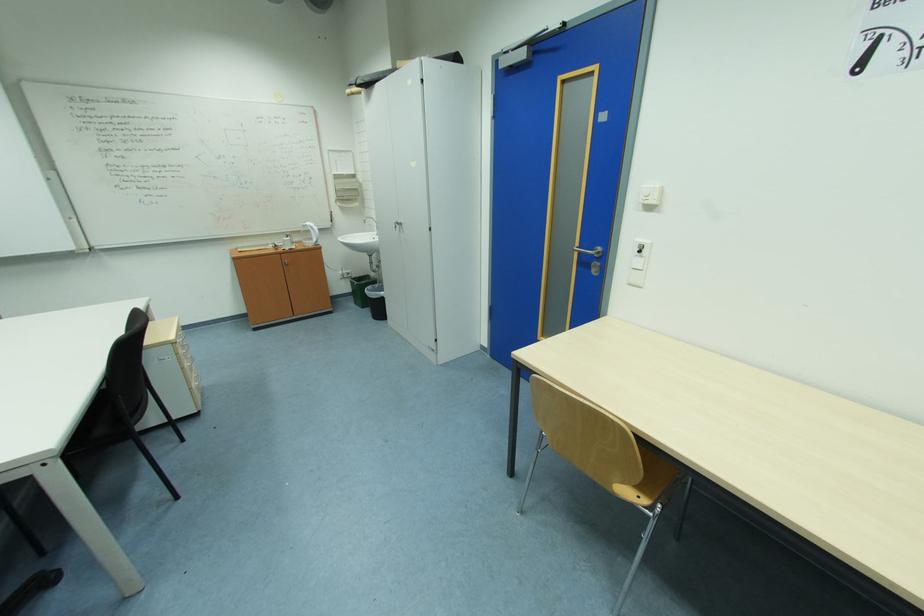
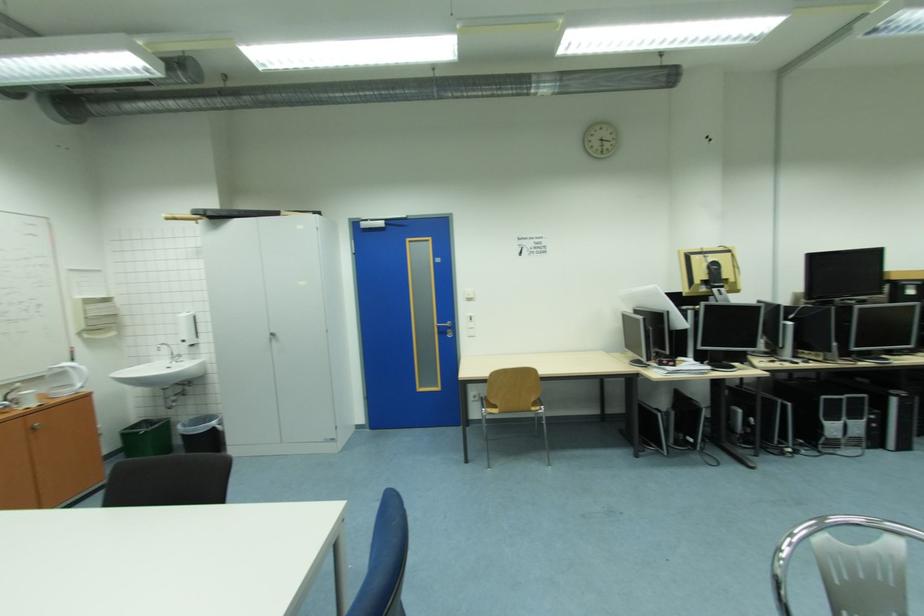
The point at (390,294) is marked in the first image. Where is the corresponding point in the second image?

(220, 424)